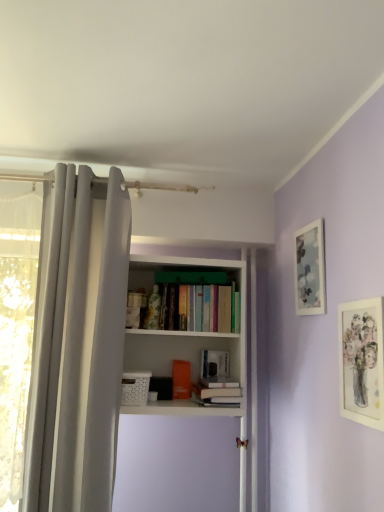
Question: From the image's perspective, is white fabric curtain at left located beneath matte glass picture frame at upper right, the first picture frame when ordered from back to front?

Choices:
 (A) yes
 (B) no

Answer: (A)

Question: From a real-world perspective, is white fabric curtain at left physically above matte glass picture frame at upper right, the first picture frame when ordered from back to front?

Choices:
 (A) no
 (B) yes

Answer: (A)

Question: From a real-world perspective, is white fabric curtain at left physically below matte glass picture frame at upper right, arranged as the second picture frame when viewed from the front?

Choices:
 (A) no
 (B) yes

Answer: (B)

Question: Is the surface of white fabric curtain at left in direct contact with matte glass picture frame at upper right, arranged as the second picture frame when viewed from the front?

Choices:
 (A) yes
 (B) no

Answer: (B)

Question: Does white fabric curtain at left have a larger size compared to matte glass picture frame at upper right, the first picture frame when ordered from back to front?

Choices:
 (A) yes
 (B) no

Answer: (A)

Question: From a real-world perspective, relative to white matte book at center, the first book viewed from the back, is white fabric curtain at left vertically above or below?

Choices:
 (A) below
 (B) above

Answer: (B)

Question: Based on their sizes in the image, would you say white fabric curtain at left is bigger or smaller than white matte book at center, the second book positioned from the front?

Choices:
 (A) small
 (B) big

Answer: (B)

Question: Does point pos(109,485) appear closer or farther from the camera than point pos(218,364)?

Choices:
 (A) closer
 (B) farther

Answer: (A)

Question: Considering the relative positions of white fabric curtain at left and white matte book at center, the first book viewed from the back, in the image provided, is white fabric curtain at left to the left or to the right of white matte book at center, the first book viewed from the back,?

Choices:
 (A) left
 (B) right

Answer: (A)

Question: Is white fabric curtain at left inside the boundaries of matte glass picture frame at upper right, the first picture frame when ordered from back to front, or outside?

Choices:
 (A) inside
 (B) outside

Answer: (B)

Question: From the image's perspective, is white fabric curtain at left above or below matte glass picture frame at upper right, the first picture frame when ordered from back to front?

Choices:
 (A) below
 (B) above

Answer: (A)

Question: Considering the positions of white fabric curtain at left and matte glass picture frame at upper right, the first picture frame when ordered from back to front, in the image, is white fabric curtain at left wider or thinner than matte glass picture frame at upper right, the first picture frame when ordered from back to front,?

Choices:
 (A) wide
 (B) thin

Answer: (A)

Question: Based on their positions, is white fabric curtain at left located to the left or right of matte glass picture frame at upper right, arranged as the second picture frame when viewed from the front?

Choices:
 (A) left
 (B) right

Answer: (A)

Question: Is white fabric curtain at left taller or shorter than white matte picture frame at upper right, the second picture frame positioned from the back?

Choices:
 (A) short
 (B) tall

Answer: (B)

Question: From the image's perspective, is white fabric curtain at left located above or below white matte picture frame at upper right, which is counted as the first picture frame, starting from the front?

Choices:
 (A) above
 (B) below

Answer: (A)